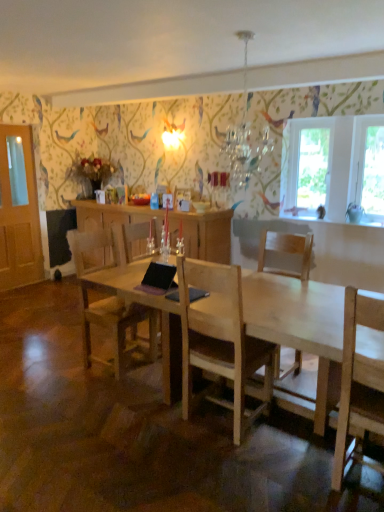
Question: Is transparent glass window at upper right, marked as the first window screen in a left-to-right arrangement, closer to camera compared to light wood chair at center, arranged as the 1th chair when viewed from the right?

Choices:
 (A) yes
 (B) no

Answer: (B)

Question: Does transparent glass window at upper right, the second window screen positioned from the right, have a lesser width compared to light wood chair at center, which ranks as the 2th chair in left-to-right order?

Choices:
 (A) yes
 (B) no

Answer: (A)

Question: From a real-world perspective, does transparent glass window at upper right, the second window screen positioned from the right, stand above light wood chair at center, arranged as the 1th chair when viewed from the right?

Choices:
 (A) no
 (B) yes

Answer: (B)

Question: Considering the relative positions of transparent glass window at upper right, marked as the first window screen in a left-to-right arrangement, and light wood chair at center, which ranks as the 2th chair in left-to-right order, in the image provided, is transparent glass window at upper right, marked as the first window screen in a left-to-right arrangement, to the left of light wood chair at center, which ranks as the 2th chair in left-to-right order, from the viewer's perspective?

Choices:
 (A) yes
 (B) no

Answer: (B)

Question: Does transparent glass window at upper right, the second window screen positioned from the right, have a larger size compared to light wood chair at center, which ranks as the 2th chair in left-to-right order?

Choices:
 (A) yes
 (B) no

Answer: (B)

Question: From a real-world perspective, is transparent glass window at right, the first window screen from the right, positioned above or below natural wood table at center?

Choices:
 (A) above
 (B) below

Answer: (A)

Question: Is transparent glass window at right, the first window screen from the right, to the left or to the right of natural wood table at center in the image?

Choices:
 (A) right
 (B) left

Answer: (A)

Question: Choose the correct answer: Is transparent glass window at right, the second window screen positioned from the left, inside natural wood table at center or outside it?

Choices:
 (A) outside
 (B) inside

Answer: (A)

Question: Considering the positions of point (364, 120) and point (314, 287), is point (364, 120) closer or farther from the camera than point (314, 287)?

Choices:
 (A) closer
 (B) farther

Answer: (B)

Question: Considering the positions of natural wood table at center and light brown wooden chair at center, the first chair viewed from the left, in the image, is natural wood table at center bigger or smaller than light brown wooden chair at center, the first chair viewed from the left,?

Choices:
 (A) small
 (B) big

Answer: (B)

Question: Is natural wood table at center in front of or behind light brown wooden chair at center, the first chair viewed from the left, in the image?

Choices:
 (A) front
 (B) behind

Answer: (A)

Question: Is natural wood table at center situated inside light brown wooden chair at center, the first chair viewed from the left, or outside?

Choices:
 (A) inside
 (B) outside

Answer: (B)

Question: In terms of width, does natural wood table at center look wider or thinner when compared to light brown wooden chair at center, arranged as the second chair when viewed from the right?

Choices:
 (A) wide
 (B) thin

Answer: (A)

Question: Considering the positions of transparent glass window at right, the second window screen positioned from the left, and crystal glass chandelier at upper center in the image, is transparent glass window at right, the second window screen positioned from the left, wider or thinner than crystal glass chandelier at upper center?

Choices:
 (A) wide
 (B) thin

Answer: (B)

Question: From the image's perspective, is transparent glass window at right, the first window screen from the right, positioned above or below crystal glass chandelier at upper center?

Choices:
 (A) above
 (B) below

Answer: (B)